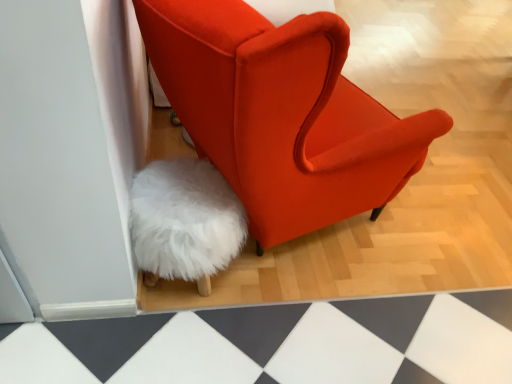
Locate an element on the screen. This screenshot has width=512, height=384. matte orange armchair at center is located at coordinates point(282,113).

Describe the element at coordinates (282, 113) in the screenshot. The image size is (512, 384). I see `matte orange armchair at center` at that location.

Locate an element on the screen. matte orange armchair at center is located at coordinates (282, 113).